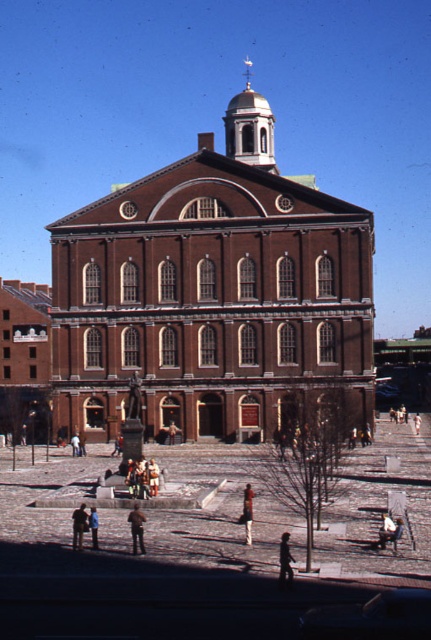
You are an interior designer who needs to place a dark brown leather jacket at lower left and a light brown wooden statue at center in a room. The room has limited space. Which object should you prioritize placing first to maximize space efficiency?

The dark brown leather jacket at lower left is bigger than the light brown wooden statue at center, so you should prioritize placing the light brown wooden statue at center first to maximize space efficiency.

You are a delivery person trying to place a large package that is 1.2 meters wide. You see the dark brown leather jacket at lower left and the light brown wooden statue at center. Can the package fit between them?

The dark brown leather jacket at lower left might be wider than light brown wooden statue at center. Since the package is 1.2 meters wide, it is uncertain if there is enough space between them. The jacket could be wider, so the space might be sufficient, but it is not certain.

You are standing in front of the brown brick church at center and the brown leather jacket at center. Which object is positioned to the left?

The brown brick church at center is to the left of the brown leather jacket at center.